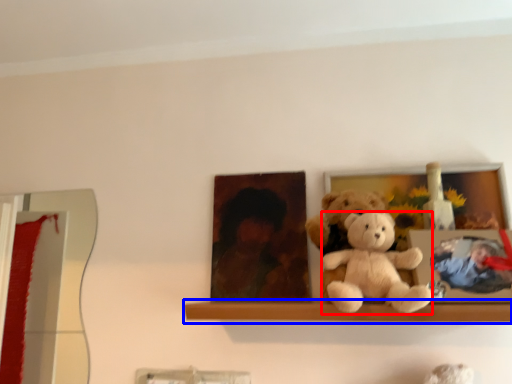
Question: Among these objects, which one is nearest to the camera, teddy bear (highlighted by a red box) or window sill (highlighted by a blue box)?

Choices:
 (A) teddy bear
 (B) window sill

Answer: (A)